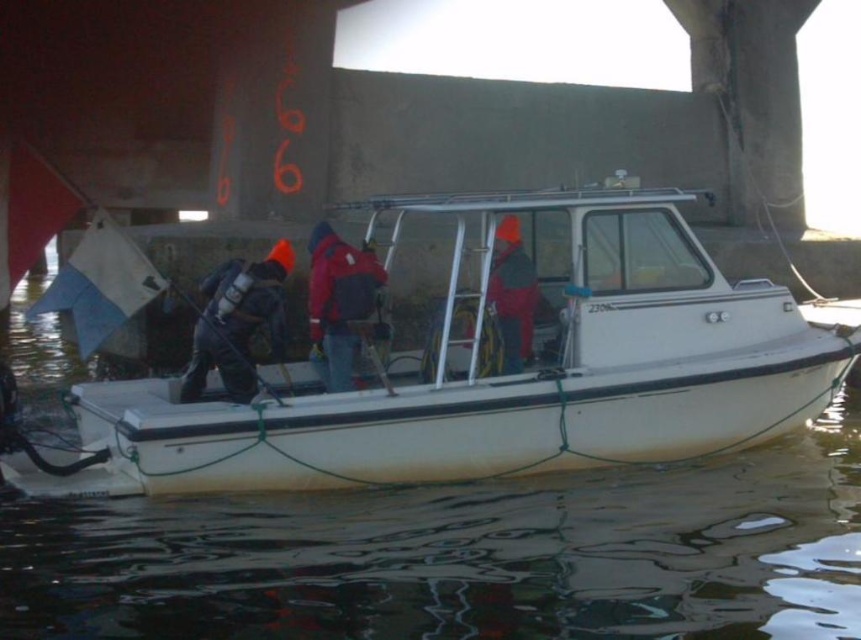
You are a GUI agent. You are given a task and a screenshot of the screen. Output one action in this format:
    pyautogui.click(x=<x>, y=<y>)
    Task: Click on the orange knit hat at center
    
    Given the screenshot: What is the action you would take?
    pyautogui.click(x=237, y=321)

Which is behind, point (289, 262) or point (338, 250)?

Point (289, 262)

You are a GUI agent. You are given a task and a screenshot of the screen. Output one action in this format:
    pyautogui.click(x=<x>, y=<y>)
    Task: Click on the orange knit hat at center
    The image size is (861, 640).
    Given the screenshot: What is the action you would take?
    pyautogui.click(x=237, y=321)

Is red nylon jacket at center above red matte jacket at center?

No, red nylon jacket at center is not above red matte jacket at center.

Does point (333, 298) come in front of point (500, 259)?

Yes, it is in front of point (500, 259).

Between point (326, 259) and point (512, 364), which one is positioned in front?

Point (326, 259) is in front.

What are the coordinates of `red nylon jacket at center` in the screenshot? It's located at (339, 304).

Is white matte boat at center smaller than orange knit hat at center?

Yes.

Locate an element on the screen. This screenshot has height=640, width=861. white matte boat at center is located at coordinates click(x=515, y=372).